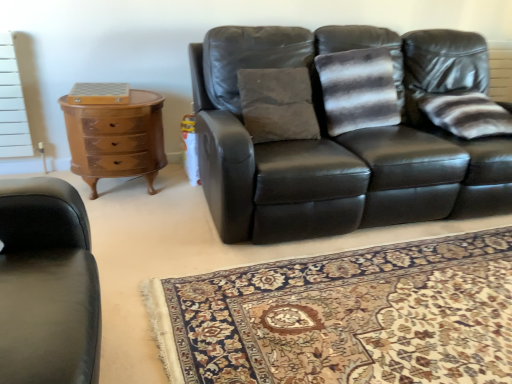
Find the location of a particular element. The image size is (512, 384). vacant space that's between matte black leather couch at center and wooden glossy chest of drawers at left is located at coordinates (152, 215).